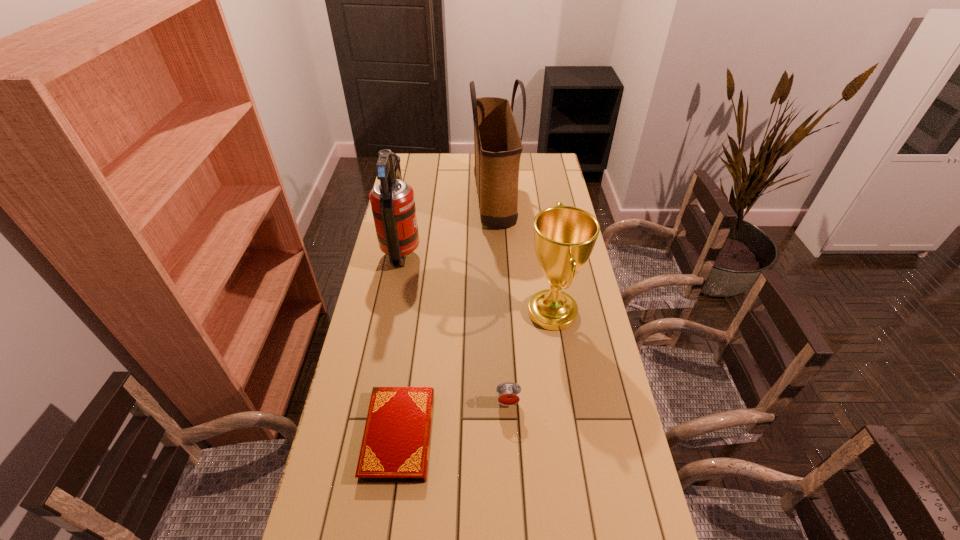
Locate an element on the screen. The image size is (960, 540). tote bag is located at coordinates (497, 143).

What are the coordinates of `fire extinguisher` in the screenshot? It's located at (392, 200).

This screenshot has height=540, width=960. I want to click on the third tallest object, so click(x=564, y=236).

At what (x,y) coordinates should I click in order to perform the action: click on the third nearest object. Please return your answer as a coordinate pair (x, y). Looking at the image, I should click on (564, 236).

This screenshot has height=540, width=960. What are the coordinates of `alarm clock` in the screenshot? It's located at (508, 393).

At what (x,y) coordinates should I click in order to perform the action: click on the shortest object. Please return your answer as a coordinate pair (x, y). Looking at the image, I should click on pos(395,447).

Identify the location of vacant space located on the right of the tote bag. pyautogui.click(x=567, y=200).

Locate an element on the screen. Image resolution: width=960 pixels, height=540 pixels. vacant space located on the front label side of the fire extinguisher is located at coordinates (520, 252).

Locate an element on the screen. The width and height of the screenshot is (960, 540). vacant space situated by the handles of the third tallest object is located at coordinates (484, 312).

Find the location of a particular element. Image resolution: width=960 pixels, height=540 pixels. vacant space situated by the handles of the third tallest object is located at coordinates (429, 312).